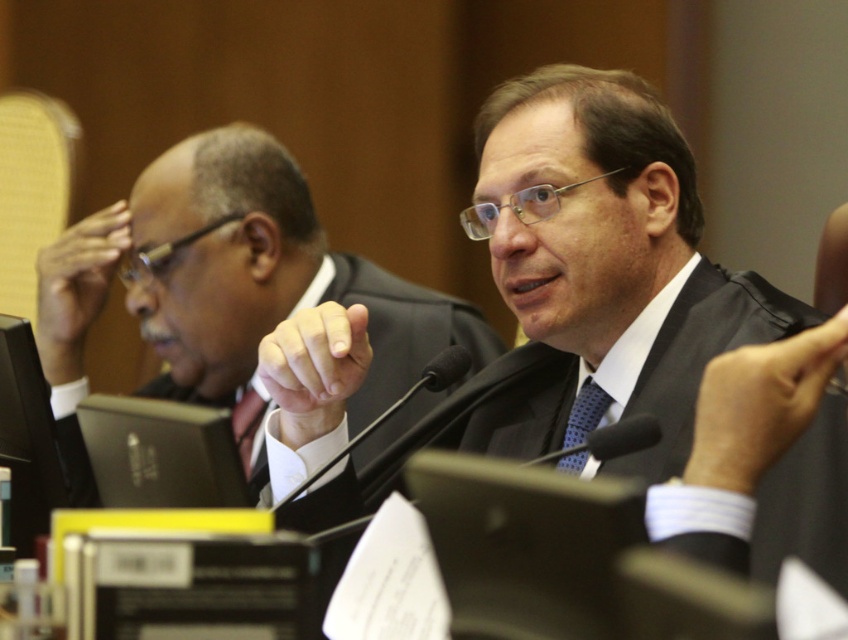
Between point (791, 486) and point (594, 401), which one is positioned in front?

Positioned in front is point (791, 486).

Find the location of a particular element. matte black suit at center is located at coordinates [x=646, y=328].

Does point (551, 360) come closer to viewer compared to point (579, 436)?

No, (551, 360) is further to viewer.

Identify the location of matte black suit at center. This screenshot has height=640, width=848. click(x=646, y=328).

Does matte black suit at left appear on the right side of matte black tie at center?

Indeed, matte black suit at left is positioned on the right side of matte black tie at center.

Who is taller, matte black suit at left or matte black tie at center?

matte black suit at left

Is point (177, 324) more distant than point (233, 403)?

No, (177, 324) is closer to viewer.

Where is `matte black suit at left`? matte black suit at left is located at coordinates (227, 285).

Which of these two, matte black suit at center or matte black suit at left, stands shorter?

Standing shorter between the two is matte black suit at center.

Does matte black suit at center have a lesser height compared to matte black suit at left?

Indeed, matte black suit at center has a lesser height compared to matte black suit at left.

Image resolution: width=848 pixels, height=640 pixels. I want to click on matte black suit at center, so click(646, 328).